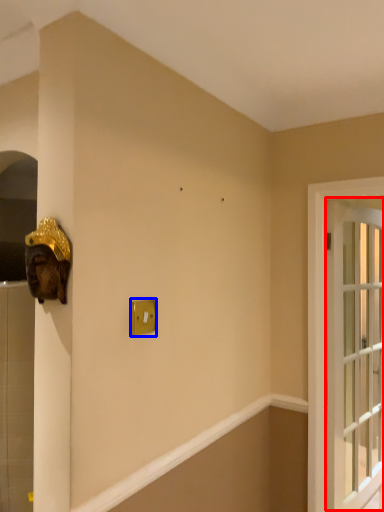
Question: Among these objects, which one is nearest to the camera, window (highlighted by a red box) or light switch (highlighted by a blue box)?

Choices:
 (A) window
 (B) light switch

Answer: (B)